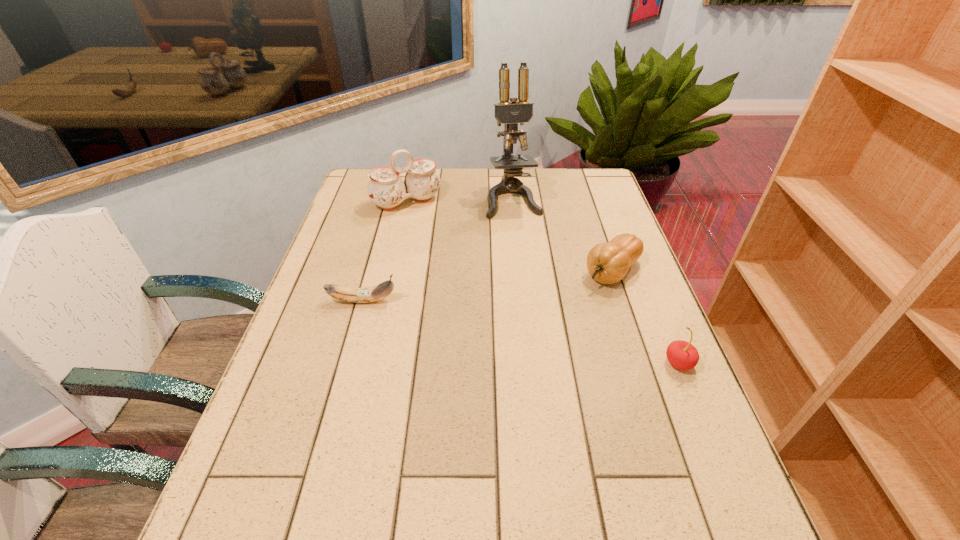
Where is `the second nearest object`? the second nearest object is located at coordinates tap(378, 292).

At what (x,y) coordinates should I click in order to perform the action: click on the nearest object. Please return your answer as a coordinate pair (x, y). Looking at the image, I should click on (682, 355).

Find the location of a particular element. This screenshot has height=540, width=960. microscope is located at coordinates (510, 113).

Identify the location of the tallest object. (510, 113).

The image size is (960, 540). Find the location of `the second tallest object`. the second tallest object is located at coordinates (386, 189).

The image size is (960, 540). Find the location of `gourd`. gourd is located at coordinates (607, 263).

Identify the location of vacant space located 0.250m on the peel of the second nearest object. The image size is (960, 540). (495, 301).

This screenshot has height=540, width=960. I want to click on vacant space located on the left of the cherry, so click(540, 363).

Identify the location of vacant region located at the eyepieces of the tallest object. coord(525,244).

You are a GUI agent. You are given a task and a screenshot of the screen. Output one action in this format:
    pyautogui.click(x=<x>, y=<y>)
    Task: Click on the vacant space located 0.060m at the eyepieces of the tallest object
    Image resolution: width=960 pixels, height=540 pixels.
    Given the screenshot: What is the action you would take?
    pyautogui.click(x=521, y=230)